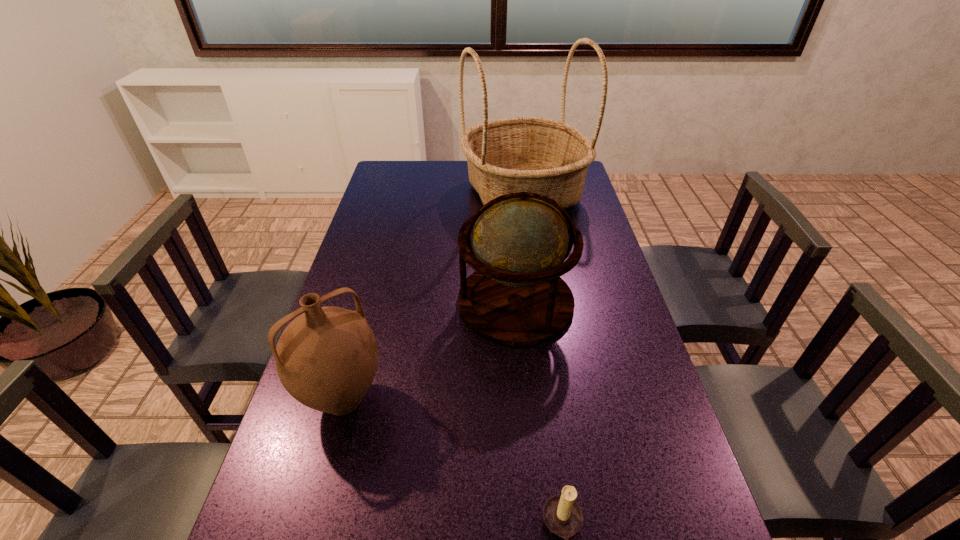
In order to click on the tallest object in this screenshot , I will do `click(548, 157)`.

Locate an element on the screen. the farthest object is located at coordinates (548, 157).

At what (x,y) coordinates should I click in order to perform the action: click on globe. Please return your answer as a coordinate pair (x, y). The height and width of the screenshot is (540, 960). Looking at the image, I should click on (516, 297).

Where is `the second nearest object`? Image resolution: width=960 pixels, height=540 pixels. the second nearest object is located at coordinates (326, 358).

This screenshot has width=960, height=540. I want to click on pitcher, so click(326, 358).

Where is `vacant region located 0.170m on the front of the basket`? This screenshot has width=960, height=540. vacant region located 0.170m on the front of the basket is located at coordinates (533, 258).

Where is `free region located 0.140m on the front-facing side of the third nearest object`? Image resolution: width=960 pixels, height=540 pixels. free region located 0.140m on the front-facing side of the third nearest object is located at coordinates coord(410,302).

I want to click on vacant area located on the front-facing side of the third nearest object, so click(x=358, y=302).

Identify the location of free region located 0.360m on the front-facing side of the third nearest object. (334, 302).

Where is `free space located 0.320m on the right of the pitcher`? The height and width of the screenshot is (540, 960). free space located 0.320m on the right of the pitcher is located at coordinates (523, 400).